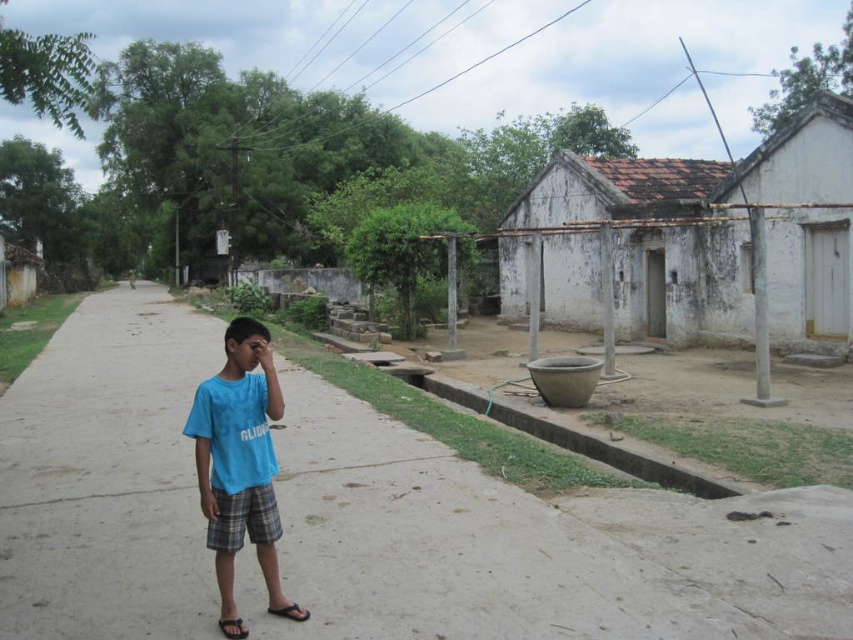
Is point (544, 166) positioned in front of point (207, 465)?

No, (544, 166) is behind (207, 465).

Between point (834, 225) and point (270, 356), which one is positioned in front?

Point (270, 356) is more forward.

Locate an element on the screen. This screenshot has height=640, width=853. white weathered hut at right is located at coordinates (683, 284).

Which is more to the left, gray concrete pavement at center or blue t-shirt at center?

Positioned to the left is gray concrete pavement at center.

Does gray concrete pavement at center have a larger size compared to blue t-shirt at center?

Correct, gray concrete pavement at center is larger in size than blue t-shirt at center.

Where is `gray concrete pavement at center`? The width and height of the screenshot is (853, 640). gray concrete pavement at center is located at coordinates (527, 547).

In order to click on gray concrete pavement at center in this screenshot , I will do `click(527, 547)`.

This screenshot has height=640, width=853. Describe the element at coordinates (527, 547) in the screenshot. I see `gray concrete pavement at center` at that location.

Is point (734, 554) farther from camera compared to point (595, 282)?

No, (734, 554) is in front of (595, 282).

Identify the location of gray concrete pavement at center. The height and width of the screenshot is (640, 853). (527, 547).